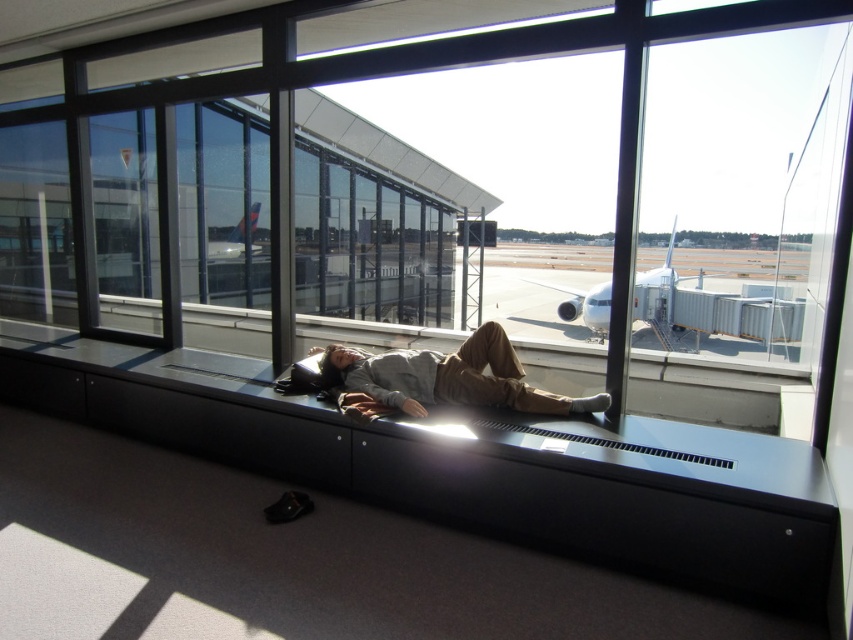
Between light brown cotton pants at center and white glossy airplane at center, which one has less height?

Standing shorter between the two is light brown cotton pants at center.

Between light brown cotton pants at center and white glossy airplane at center, which one appears on the right side from the viewer's perspective?

light brown cotton pants at center

Describe the element at coordinates (450, 378) in the screenshot. I see `light brown cotton pants at center` at that location.

You are a GUI agent. You are given a task and a screenshot of the screen. Output one action in this format:
    pyautogui.click(x=<x>, y=<y>)
    Task: Click on the light brown cotton pants at center
    The image size is (853, 640).
    Given the screenshot: What is the action you would take?
    pyautogui.click(x=450, y=378)

Who is positioned more to the right, light brown cotton pants at center or white matte airplane at center?

Positioned to the right is white matte airplane at center.

Who is more forward, (393, 358) or (604, 285)?

Point (393, 358) is more forward.

Which is behind, point (479, 400) or point (592, 292)?

The point (592, 292) is more distant.

You are a GUI agent. You are given a task and a screenshot of the screen. Output one action in this format:
    pyautogui.click(x=<x>, y=<y>)
    Task: Click on the light brown cotton pants at center
    
    Given the screenshot: What is the action you would take?
    pyautogui.click(x=450, y=378)

Between white matte airplane at center and white glossy airplane at center, which one is positioned higher?

Positioned higher is white matte airplane at center.

Does point (659, 272) lie behind point (213, 243)?

Yes, it is.

This screenshot has width=853, height=640. Identify the location of white matte airplane at center. (584, 304).